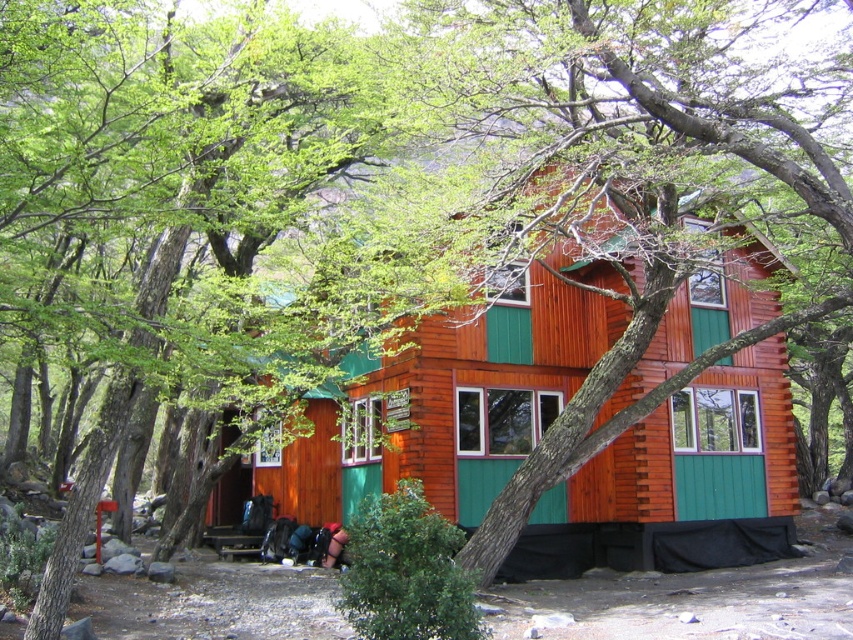
Question: Is wooden cabin at center positioned before green wood tree at center?

Choices:
 (A) yes
 (B) no

Answer: (B)

Question: Is wooden cabin at center further to camera compared to green wood tree at center?

Choices:
 (A) no
 (B) yes

Answer: (B)

Question: Which object is farther from the camera taking this photo?

Choices:
 (A) wooden cabin at center
 (B) green wood tree at center

Answer: (A)

Question: Among these objects, which one is farthest from the camera?

Choices:
 (A) green wood tree at center
 (B) wooden cabin at center

Answer: (B)

Question: Among these points, which one is nearest to the camera?

Choices:
 (A) (662, 60)
 (B) (469, 365)

Answer: (A)

Question: Does wooden cabin at center appear under green wood tree at center?

Choices:
 (A) no
 (B) yes

Answer: (B)